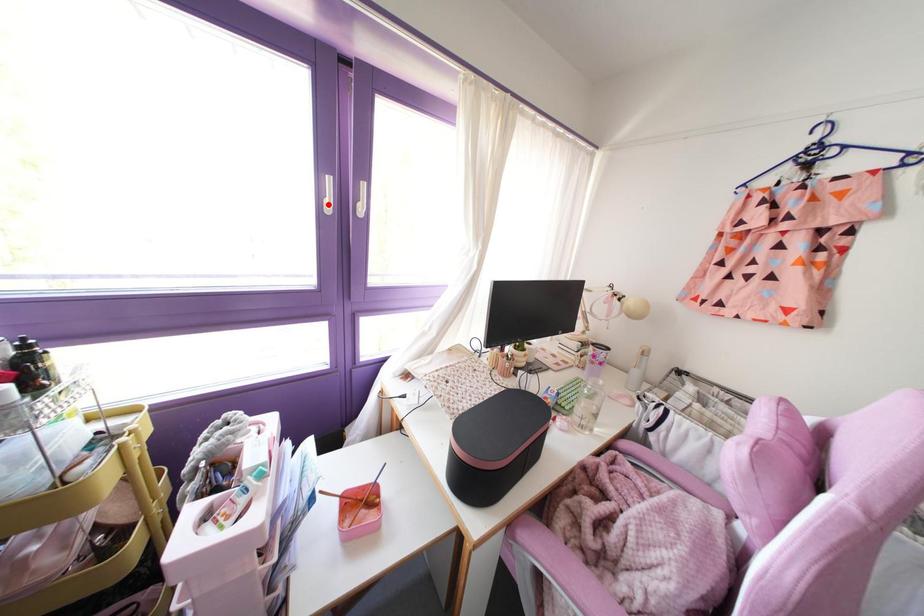
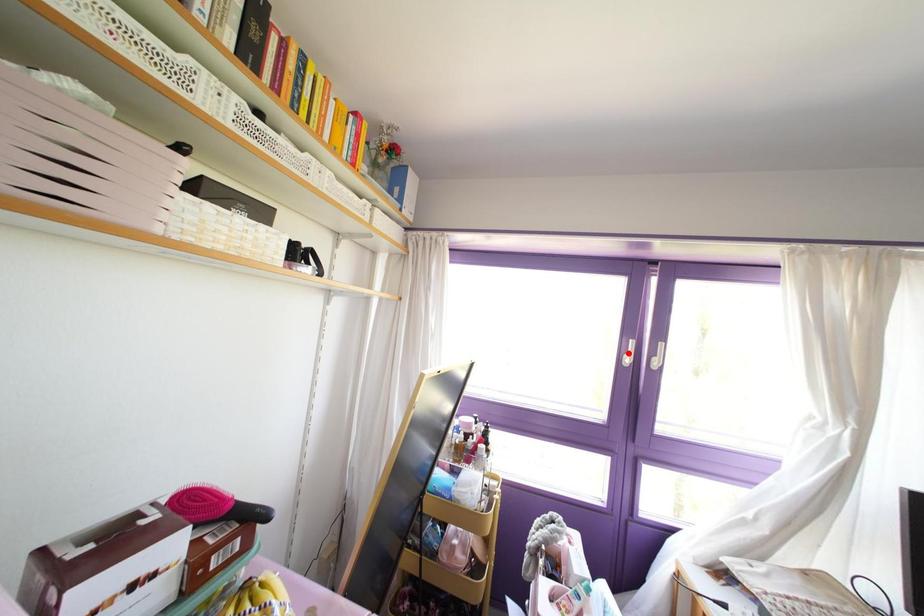
I am providing you with two images of the same scene from different viewpoints. A red point is marked on the first image and another point is marked on the second image. Is the red point in image1 aligned with the point shown in image2?

No